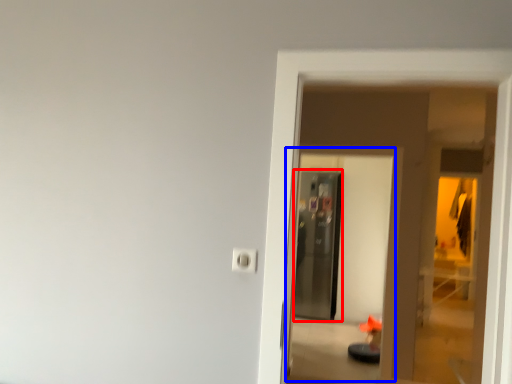
Question: Which object appears farthest to the camera in this image, screen door (highlighted by a red box) or screen door (highlighted by a blue box)?

Choices:
 (A) screen door
 (B) screen door

Answer: (A)